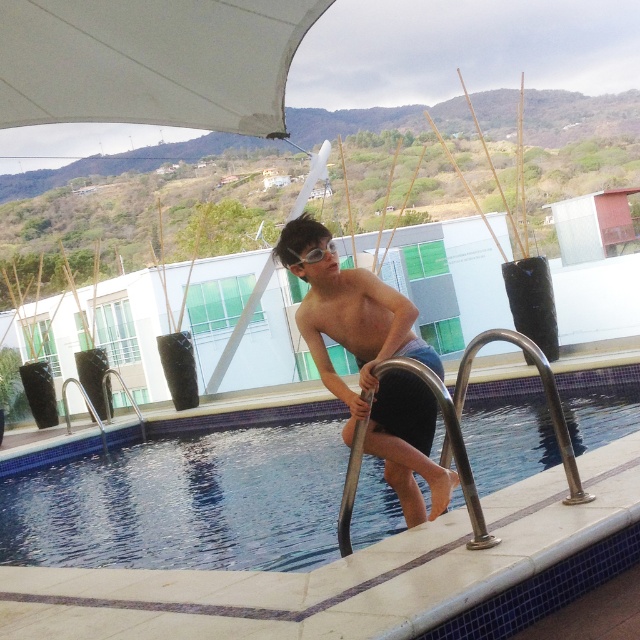
Question: Is light blue denim shorts at center positioned at the back of clear plastic goggles at upper center?

Choices:
 (A) yes
 (B) no

Answer: (B)

Question: Which point is closer to the camera taking this photo?

Choices:
 (A) (216, 452)
 (B) (298, 260)

Answer: (B)

Question: In this image, where is light blue denim shorts at center located relative to clear plastic goggles at upper center?

Choices:
 (A) right
 (B) left

Answer: (A)

Question: Which point is farther from the camera taking this photo?

Choices:
 (A) (166, 525)
 (B) (298, 227)

Answer: (A)

Question: Which object is the farthest from the clear plastic goggles at upper center?

Choices:
 (A) light blue denim shorts at center
 (B) blue glossy water at center

Answer: (B)

Question: Is blue glossy water at center thinner than clear plastic goggles at upper center?

Choices:
 (A) yes
 (B) no

Answer: (B)